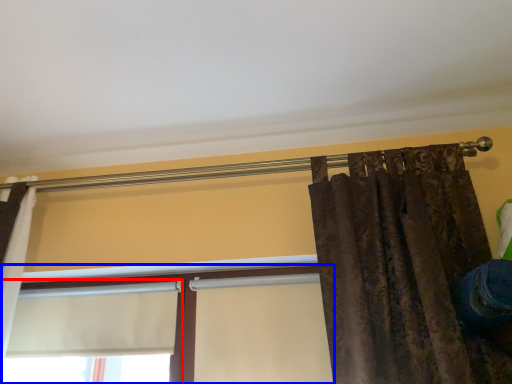
Question: Among these objects, which one is farthest to the camera, window (highlighted by a red box) or window (highlighted by a blue box)?

Choices:
 (A) window
 (B) window

Answer: (A)